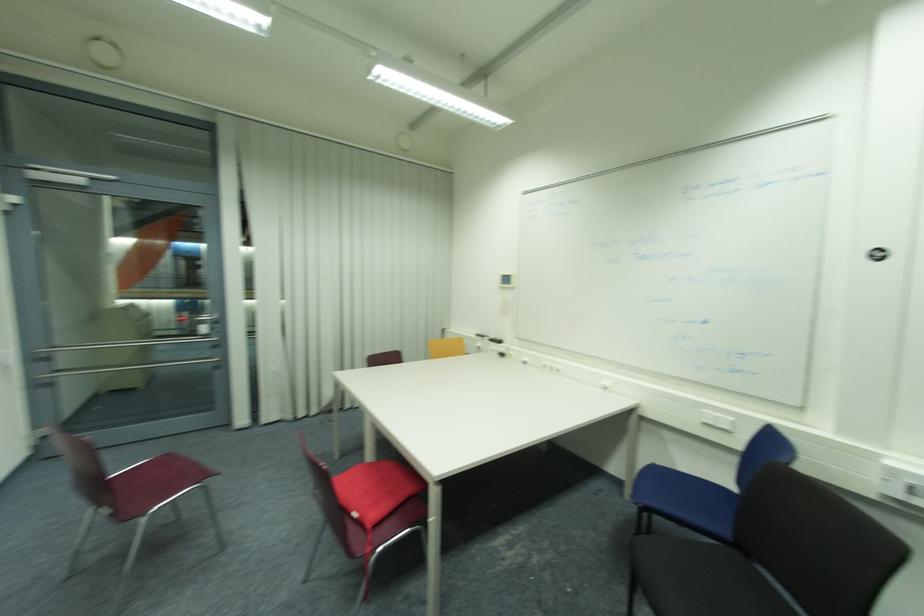
Find the location of a particular element. The height and width of the screenshot is (616, 924). blue chair sitting surface is located at coordinates (678, 491).